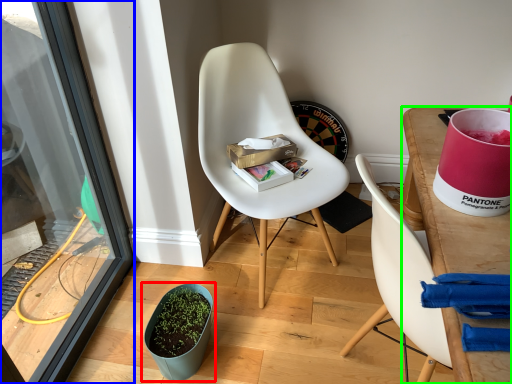
Question: Which object is the closest to the flowerpot (highlighted by a red box)? Choose among these: screen door (highlighted by a blue box) or desk (highlighted by a green box).

Choices:
 (A) screen door
 (B) desk

Answer: (A)